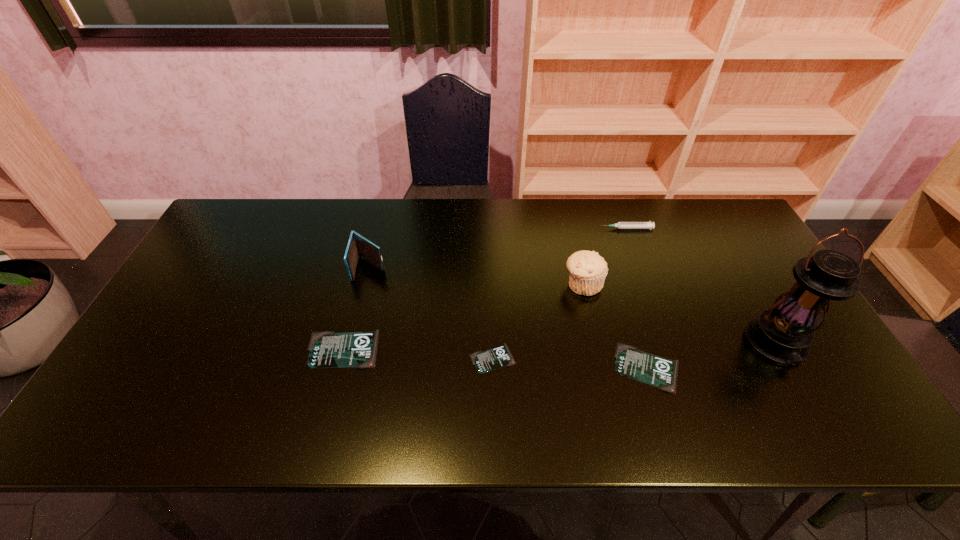
Locate an element on the screen. This screenshot has height=540, width=960. muffin is located at coordinates (587, 270).

Where is `vacant space located on the back of the leftmost identity card`? vacant space located on the back of the leftmost identity card is located at coordinates (365, 266).

What are the coordinates of `free space located on the left of the shortest object` in the screenshot? It's located at (357, 358).

Where is `free space located on the left of the second shortest object`? The image size is (960, 540). free space located on the left of the second shortest object is located at coordinates (492, 368).

Where is `vacant space located on the exterior surface of the wallet`? vacant space located on the exterior surface of the wallet is located at coordinates (355, 326).

You are a GUI agent. You are given a task and a screenshot of the screen. Output one action in this format:
    pyautogui.click(x=<x>, y=<y>)
    Task: Click on the vacant area situated 0.200m at the needle end of the syringe
    
    Given the screenshot: What is the action you would take?
    pyautogui.click(x=539, y=228)

This screenshot has width=960, height=540. I want to click on vacant area situated at the needle end of the syringe, so click(529, 228).

Identify the location of free region located 0.280m at the needle end of the syringe. [515, 228].

Select a few points in free space located above the lantern, indicating its light source. Please provide its 2D coordinates. Your answer should be formatted as a tuple, i.e. [(x, y)], where the tuple contains the x and y coordinates of a point satisfying the conditions above.

[(802, 390)]

The image size is (960, 540). I want to click on vacant space located 0.110m on the right of the muffin, so click(641, 284).